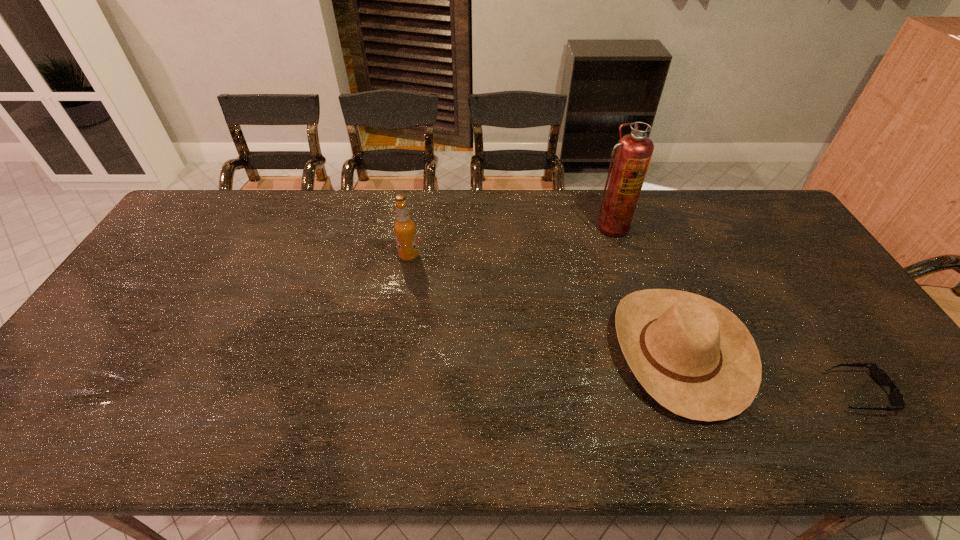
In the image, there is a desktop. Where is `vacant space at the far edge`? vacant space at the far edge is located at coordinates (368, 197).

This screenshot has width=960, height=540. What are the coordinates of `vacant space at the near edge of the desktop` in the screenshot? It's located at (718, 431).

This screenshot has width=960, height=540. I want to click on vacant space at the right edge, so click(792, 305).

You are a GUI agent. You are given a task and a screenshot of the screen. Output one action in this format:
    pyautogui.click(x=<x>, y=<y>)
    Task: Click on the free space at the far left corner of the desktop
    Image resolution: width=960 pixels, height=540 pixels.
    Given the screenshot: What is the action you would take?
    pyautogui.click(x=180, y=224)

Locate an element on the screen. free space at the near left corner is located at coordinates (54, 420).

Locate an element on the screen. The width and height of the screenshot is (960, 540). vacant region at the near right corner of the desktop is located at coordinates (896, 443).

What are the coordinates of `vacant space that is in between the fire extinguisher and the leftmost object` in the screenshot? It's located at (510, 242).

The image size is (960, 540). Find the location of `blank region between the beer bottle and the fire extinguisher`. blank region between the beer bottle and the fire extinguisher is located at coordinates (510, 242).

At what (x,y) coordinates should I click in order to perform the action: click on unoccupied position between the sunglasses and the fire extinguisher. Please return your answer as a coordinate pair (x, y). The height and width of the screenshot is (540, 960). Looking at the image, I should click on pyautogui.click(x=734, y=310).

This screenshot has width=960, height=540. Identify the location of vacant space that is in between the rightmost object and the third tallest object. (768, 372).